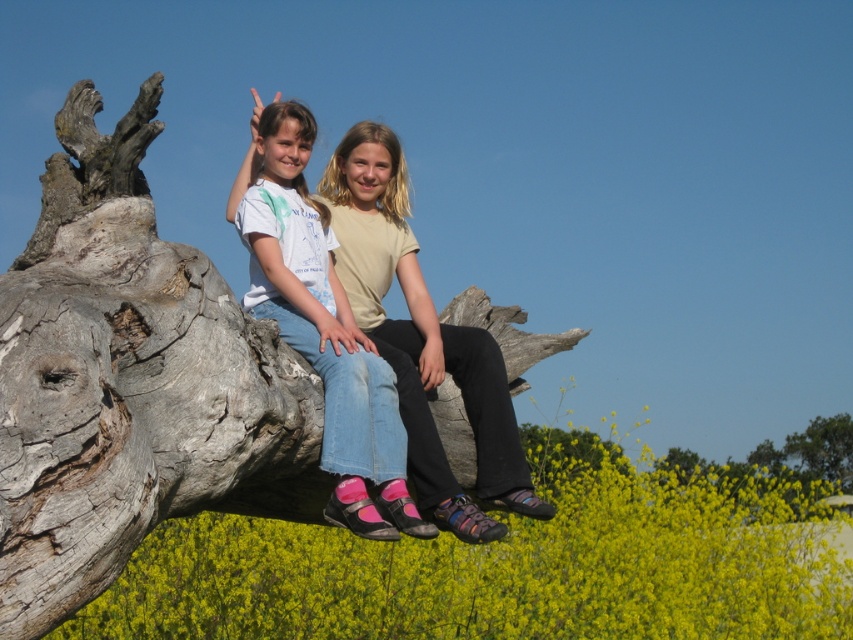
Question: Does gray rough tree trunk at center have a greater width compared to light beige cotton shirt at center?

Choices:
 (A) no
 (B) yes

Answer: (B)

Question: Is the position of gray rough tree trunk at center less distant than that of green leafy tree at upper right?

Choices:
 (A) yes
 (B) no

Answer: (A)

Question: Which of the following is the farthest from the observer?

Choices:
 (A) denim jeans at center
 (B) green leafy tree at upper right
 (C) smooth gray tree trunk at center
 (D) gray rough tree trunk at center

Answer: (B)

Question: Which object is positioned closest to the green leafy tree at upper right?

Choices:
 (A) smooth gray tree trunk at center
 (B) denim jeans at center
 (C) light beige cotton shirt at center
 (D) gray rough tree trunk at center

Answer: (A)

Question: Among these points, which one is farthest from the camera?

Choices:
 (A) (614, 467)
 (B) (416, 464)
 (C) (837, 454)

Answer: (C)

Question: Can you confirm if light beige cotton shirt at center is positioned below smooth gray tree trunk at center?

Choices:
 (A) yes
 (B) no

Answer: (B)